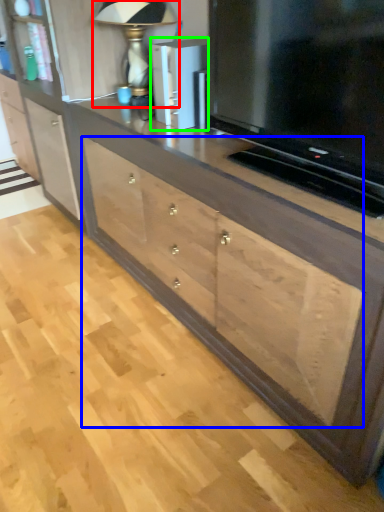
Question: Based on their relative distances, which object is farther from table lamp (highlighted by a red box)? Choose from drawer (highlighted by a blue box) and appliance (highlighted by a green box).

Choices:
 (A) drawer
 (B) appliance

Answer: (A)